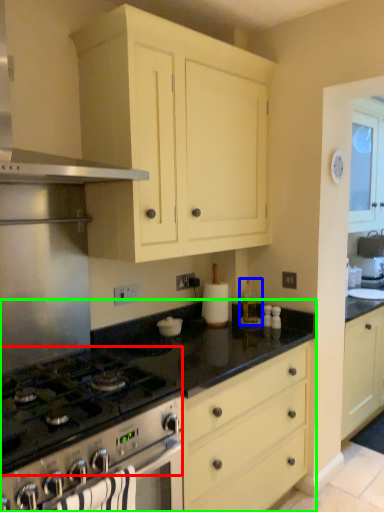
Question: Which object is the closest to the gas stove (highlighted by a red box)? Choose among these: appliance (highlighted by a blue box) or countertop (highlighted by a green box).

Choices:
 (A) appliance
 (B) countertop

Answer: (B)